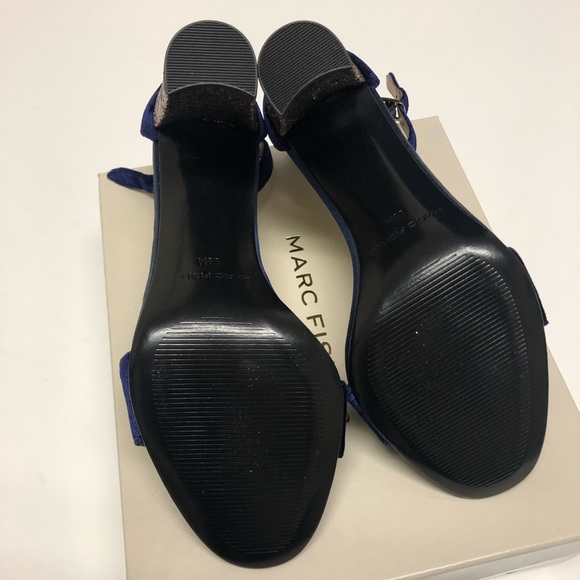
The image size is (580, 580). I want to click on stand, so click(385, 527).